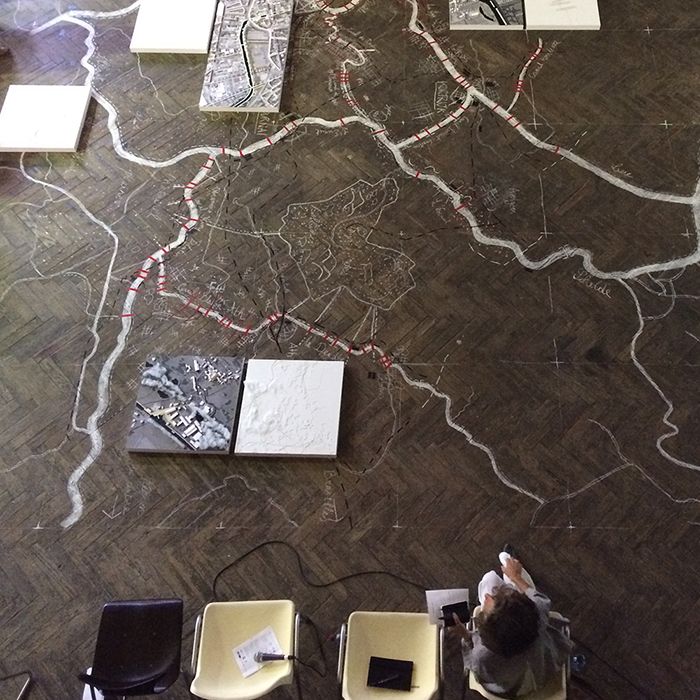
Where is `occupied chair`? Image resolution: width=700 pixels, height=700 pixels. occupied chair is located at coordinates (477, 690).